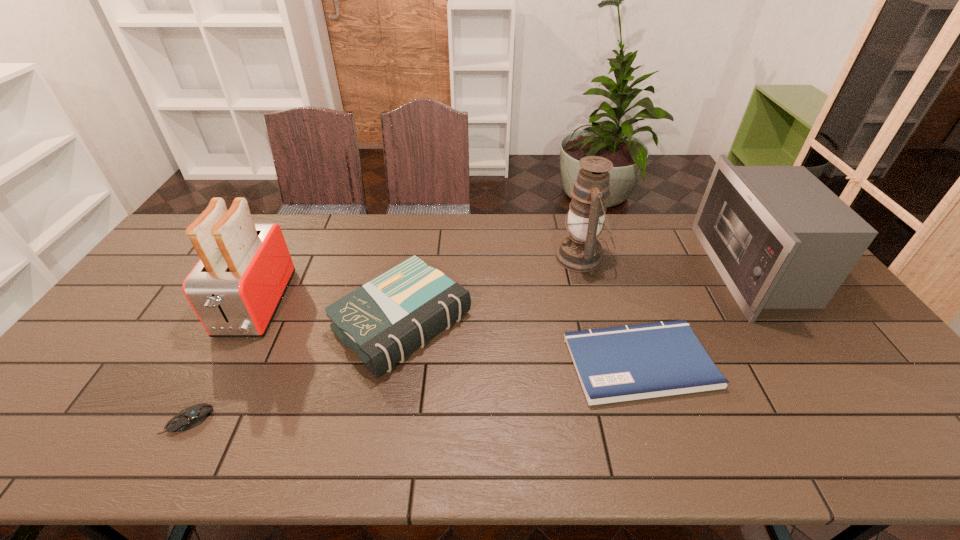
You are a GUI agent. You are given a task and a screenshot of the screen. Output one action in this format:
    pyautogui.click(x=<x>, y=<y>)
    Task: Click on the free space located on the front-facing side of the rightmost object
    
    Given the screenshot: What is the action you would take?
    pyautogui.click(x=630, y=269)

Identify the location of vacant space positioned 0.220m on the front-facing side of the rightmost object. The width and height of the screenshot is (960, 540). (646, 269).

The width and height of the screenshot is (960, 540). I want to click on vacant space located on the back of the left paperback book, so click(416, 248).

You are a GUI agent. You are given a task and a screenshot of the screen. Output one action in this format:
    pyautogui.click(x=<x>, y=<y>)
    Task: Click on the blank area located on the back of the shorter paperback book
    
    Given the screenshot: What is the action you would take?
    pyautogui.click(x=612, y=279)

Where is `vacant region located on the right of the computer mouse`? This screenshot has height=540, width=960. vacant region located on the right of the computer mouse is located at coordinates (313, 421).

The height and width of the screenshot is (540, 960). I want to click on oil lamp that is positioned at the far edge, so click(x=579, y=251).

Locate an element on the screen. microwave oven that is at the far edge is located at coordinates (780, 239).

Find the location of a particular element. Image resolution: width=960 pixels, height=540 pixels. object positioned at the near edge is located at coordinates (190, 417).

This screenshot has height=540, width=960. Identify the location of object that is at the right edge. (780, 239).

The image size is (960, 540). In order to click on object that is at the far right corner in this screenshot , I will do `click(780, 239)`.